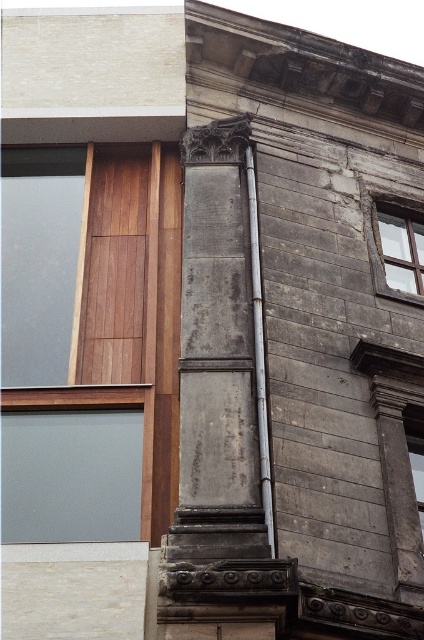
What are the coordinates of the matte gray stone window at upper right in the image?

The coordinates of the matte gray stone window at upper right are point (395, 244).

You are standing at the point with coordinates closest to the traditional stone wall section. You notice two points marked in the image. Which point, point (378, 218) or point (253, 323), is closer to your current position?

Point (253, 323) is closer to your current position because it is in front of point (378, 218).